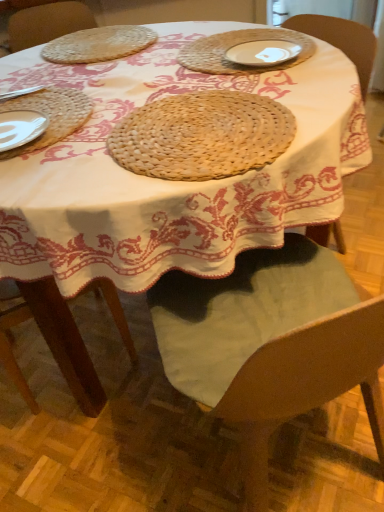
The height and width of the screenshot is (512, 384). Find the location of `vacant area to the left of natural woven placemat at center, which is the 1th pie from bottom to top`. vacant area to the left of natural woven placemat at center, which is the 1th pie from bottom to top is located at coordinates (73, 154).